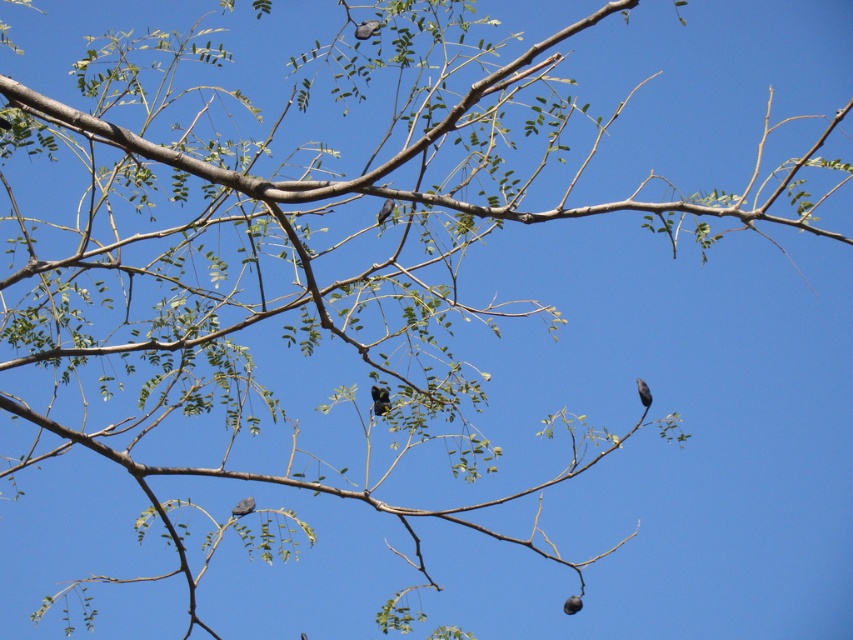
You are an ornithologist observing two birds perched on the same tree branch. You need to determine which bird is smaller in width. The birds are the silvery metallic bird at center and the brown matte bird at center. Which one has a smaller width?

The silvery metallic bird at center has a lesser width compared to the brown matte bird at center, so the silvery metallic bird at center is smaller in width.

You are a birdwatcher observing the tree and noting the birds. Which bird, the gray matte bird at center or the brown matte bird at center, is smaller in size?

The gray matte bird at center is smaller in size than the brown matte bird at center because it occupies less space.

You are a birdwatcher with a camera that has a maximum focus range of 20 inches. You spot two birds, the gray matte bird at center and the brown matte bird at center. Can your camera capture both birds in focus at the same time?

The gray matte bird at center and brown matte bird at center are 23.62 inches apart from each other. Since your camera has a maximum focus range of 20 inches, it cannot capture both birds in focus simultaneously.